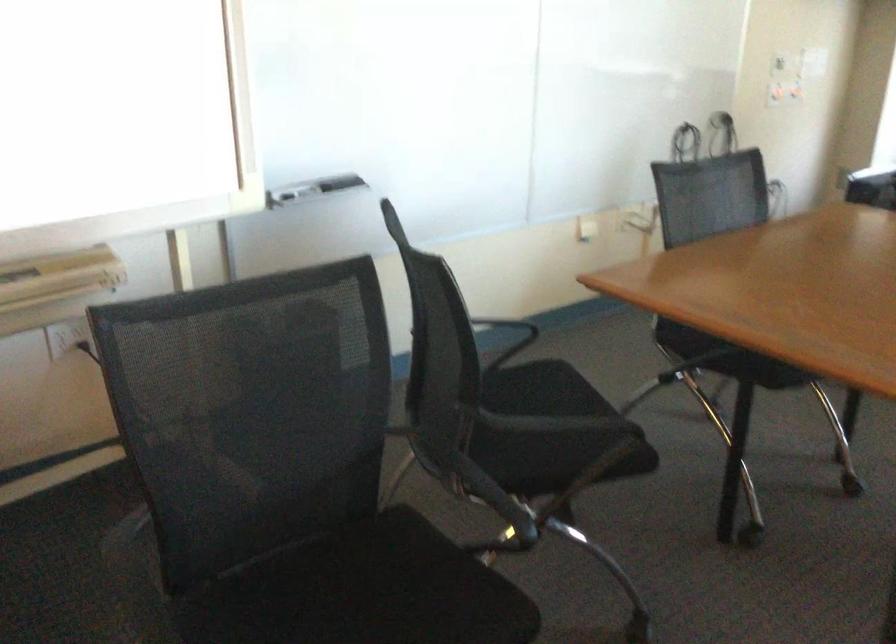
The width and height of the screenshot is (896, 644). Describe the element at coordinates (312, 189) in the screenshot. I see `the whiteboard marker tray` at that location.